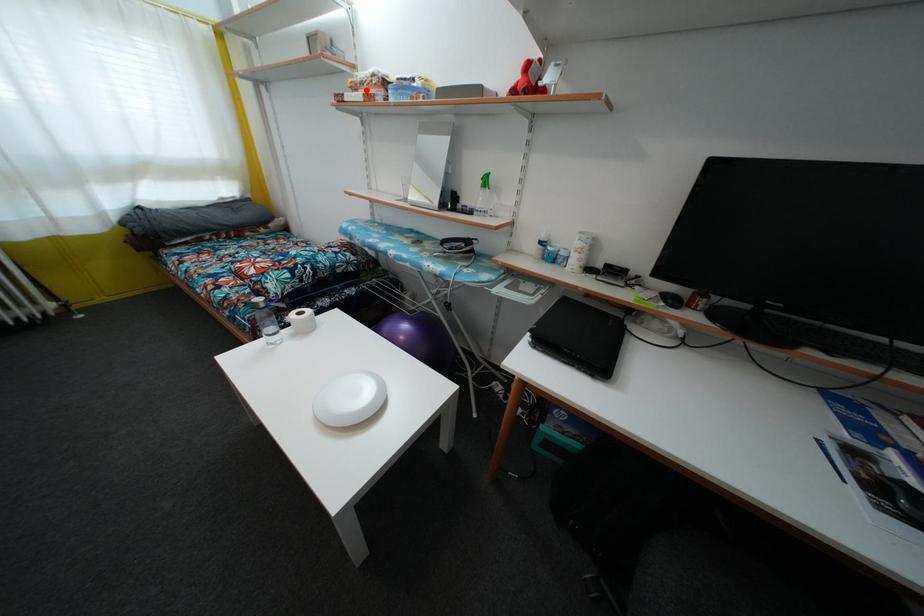
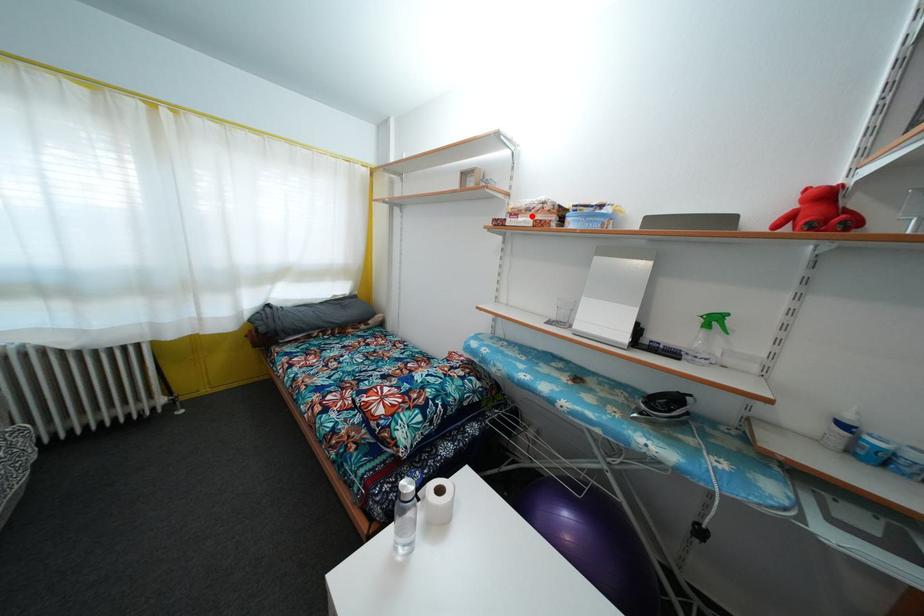
I am providing you with two images of the same scene from different viewpoints. A red point is marked on the first image and another point is marked on the second image. Is the marked point in image1 the same physical position as the marked point in image2?

Yes